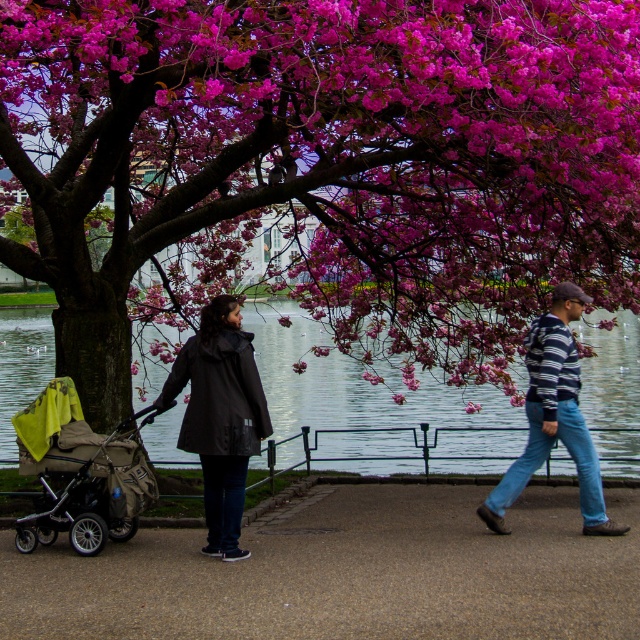
You are standing at the point labeled as point [346,573] in the image. What type of surface are you currently standing on?

The point [346,573] corresponds to the concrete sidewalk at center, so you are standing on a concrete sidewalk.